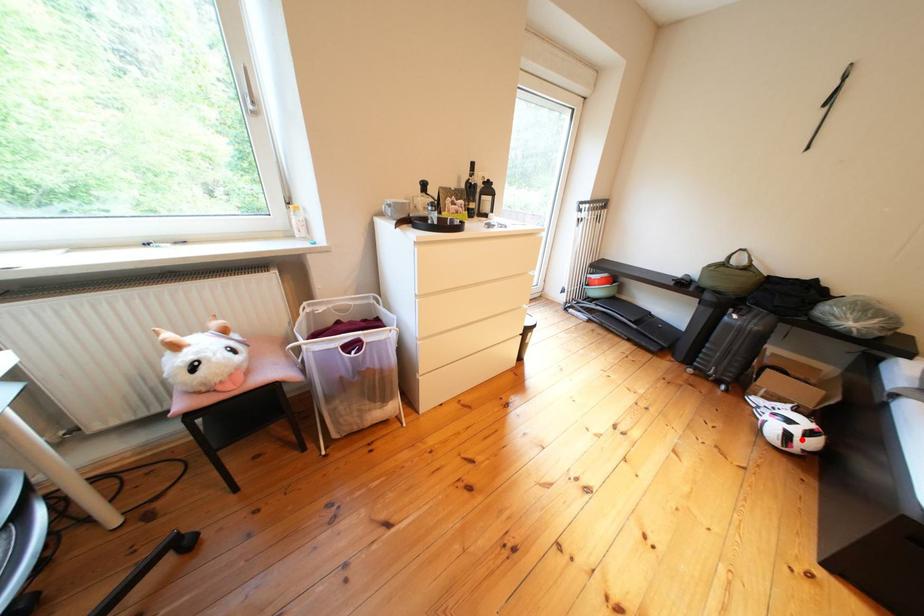
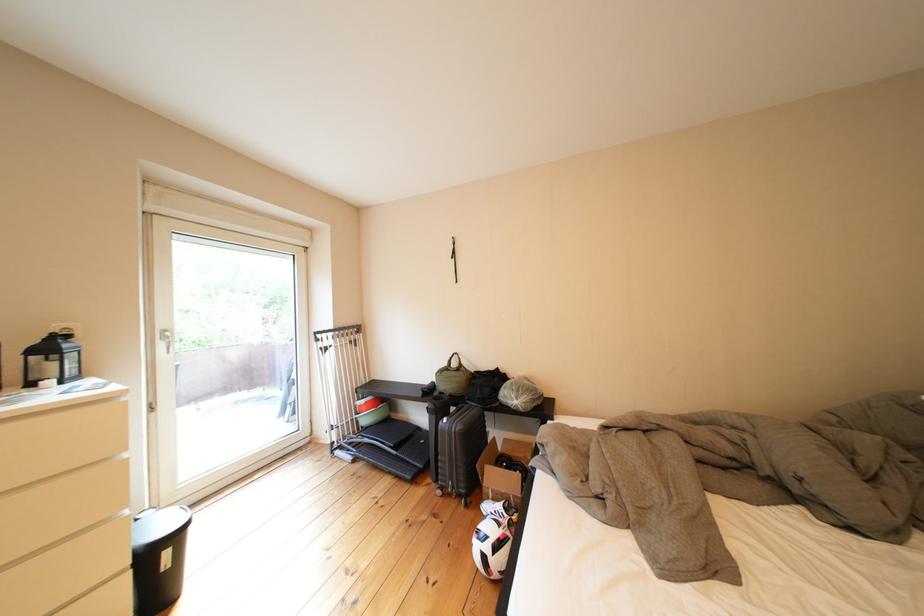
The point at the highlighted location is marked in the first image. Where is the corresponding point in the second image?

(499, 562)